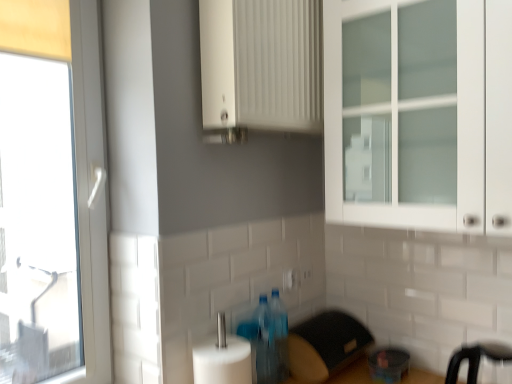
Question: Which direction should I rotate to look at translucent plastic bottle at center, the first bottle viewed from the back, — up or down?

Choices:
 (A) up
 (B) down

Answer: (B)

Question: Is black plastic bar stool at lower right positioned in front of translucent plastic bottle at center, marked as the second bottle in a front-to-back arrangement?

Choices:
 (A) yes
 (B) no

Answer: (A)

Question: From the image's perspective, does black plastic bar stool at lower right appear higher than translucent plastic bottle at center, the first bottle viewed from the back?

Choices:
 (A) yes
 (B) no

Answer: (B)

Question: Is black plastic bar stool at lower right thinner than translucent plastic bottle at center, marked as the second bottle in a front-to-back arrangement?

Choices:
 (A) yes
 (B) no

Answer: (B)

Question: Could you tell me if black plastic bar stool at lower right is turned towards translucent plastic bottle at center, marked as the second bottle in a front-to-back arrangement?

Choices:
 (A) no
 (B) yes

Answer: (A)

Question: Considering the relative sizes of black plastic bar stool at lower right and translucent plastic bottle at center, the first bottle viewed from the back, in the image provided, is black plastic bar stool at lower right taller than translucent plastic bottle at center, the first bottle viewed from the back,?

Choices:
 (A) no
 (B) yes

Answer: (A)

Question: Are black plastic bar stool at lower right and translucent plastic bottle at center, the first bottle viewed from the back, making contact?

Choices:
 (A) no
 (B) yes

Answer: (A)

Question: From the image's perspective, is translucent plastic bottle at center, the first bottle viewed from the back, above transparent plastic container at lower right, which appears as the first appliance when viewed from the right?

Choices:
 (A) yes
 (B) no

Answer: (A)

Question: Is translucent plastic bottle at center, the first bottle viewed from the back, at the right side of transparent plastic container at lower right, which appears as the first appliance when viewed from the right?

Choices:
 (A) yes
 (B) no

Answer: (B)

Question: Considering the relative sizes of translucent plastic bottle at center, the first bottle viewed from the back, and transparent plastic container at lower right, marked as the 2th appliance in a left-to-right arrangement, in the image provided, is translucent plastic bottle at center, the first bottle viewed from the back, shorter than transparent plastic container at lower right, marked as the 2th appliance in a left-to-right arrangement,?

Choices:
 (A) no
 (B) yes

Answer: (A)

Question: Does translucent plastic bottle at center, the first bottle viewed from the back, have a smaller size compared to transparent plastic container at lower right, which appears as the first appliance when viewed from the right?

Choices:
 (A) no
 (B) yes

Answer: (A)

Question: Is transparent plastic container at lower right, marked as the 2th appliance in a left-to-right arrangement, at the back of translucent plastic bottle at center, the first bottle viewed from the back?

Choices:
 (A) no
 (B) yes

Answer: (A)

Question: Is translucent plastic bottle at center, the first bottle viewed from the back, far away from transparent plastic container at lower right, marked as the 2th appliance in a left-to-right arrangement?

Choices:
 (A) no
 (B) yes

Answer: (A)

Question: Does translucent plastic bottles at lower center, positioned as the 2th bottle in back-to-front order, turn towards black plastic bar stool at lower right?

Choices:
 (A) no
 (B) yes

Answer: (A)